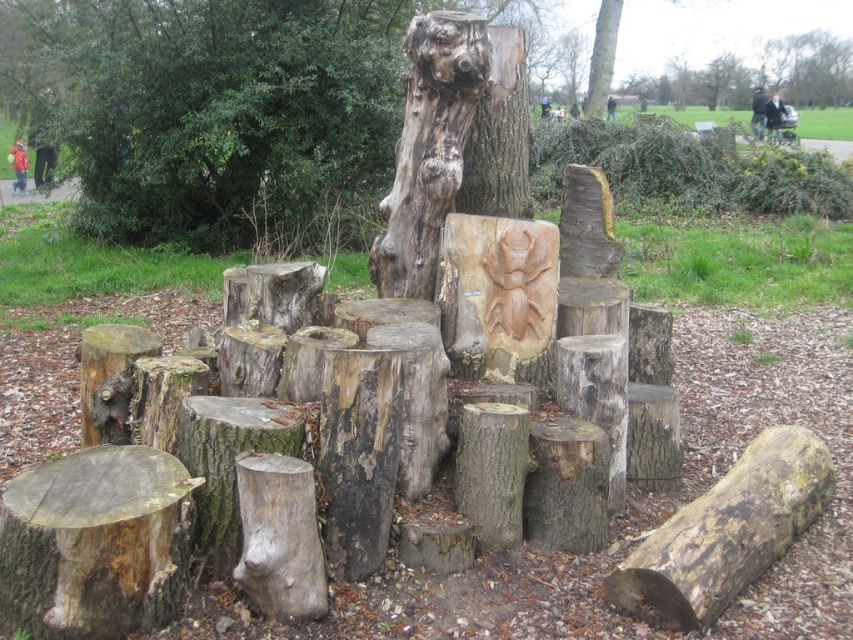
Question: Which point appears closest to the camera in this image?

Choices:
 (A) (590, 70)
 (B) (834, 93)
 (C) (22, 77)

Answer: (C)

Question: Does natural wood tree stump at center appear on the right side of smooth wooden bench at upper center?

Choices:
 (A) no
 (B) yes

Answer: (A)

Question: Does natural wood tree stump at center have a greater width compared to smooth wooden bench at upper center?

Choices:
 (A) no
 (B) yes

Answer: (A)

Question: Can you confirm if natural wood tree stump at center is smaller than smooth wooden bench at upper center?

Choices:
 (A) yes
 (B) no

Answer: (B)

Question: Which of the following is the farthest from the observer?

Choices:
 (A) (152, 193)
 (B) (596, 90)
 (C) (844, 68)

Answer: (C)

Question: Which point is closer to the camera?

Choices:
 (A) (590, 100)
 (B) (680, 93)

Answer: (A)